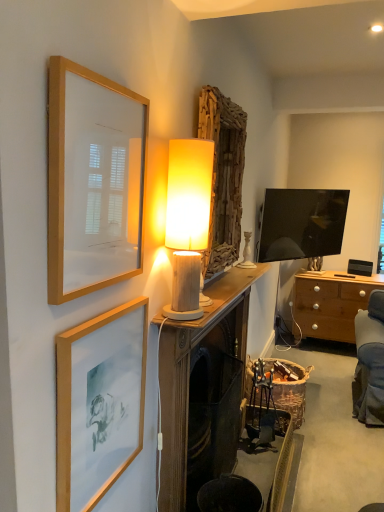
Measure the distance between metallic silver swivel chair at lower right and camera.

The distance of metallic silver swivel chair at lower right from camera is 8.23 feet.

You are a GUI agent. You are given a task and a screenshot of the screen. Output one action in this format:
    pyautogui.click(x=<x>, y=<y>)
    Task: Click on the wooden chest of drawers at right
    The image size is (384, 512).
    Given the screenshot: What is the action you would take?
    pyautogui.click(x=331, y=303)

The height and width of the screenshot is (512, 384). Describe the element at coordinates (331, 303) in the screenshot. I see `wooden chest of drawers at right` at that location.

Where is `wooden framed print at upper left, the 2th picture frame in the bottom-to-top sequence`? The height and width of the screenshot is (512, 384). wooden framed print at upper left, the 2th picture frame in the bottom-to-top sequence is located at coordinates (93, 181).

Locate an element on the screen. The width and height of the screenshot is (384, 512). metallic silver swivel chair at lower right is located at coordinates (264, 408).

From the image's perspective, does wooden mantlepiece at center appear lower than matte gold picture frame at lower left, which appears as the 2th picture frame when viewed from the top?

Yes, from the image's perspective, wooden mantlepiece at center is beneath matte gold picture frame at lower left, which appears as the 2th picture frame when viewed from the top.

Which is more to the left, wooden mantlepiece at center or matte gold picture frame at lower left, which is the first picture frame in bottom-to-top order?

From the viewer's perspective, matte gold picture frame at lower left, which is the first picture frame in bottom-to-top order, appears more on the left side.

Is point (170, 351) positioned in front of point (82, 387)?

That is False.

Consider the image. Who is smaller, wooden mantlepiece at center or matte gold picture frame at lower left, which is the first picture frame in bottom-to-top order?

Smaller between the two is matte gold picture frame at lower left, which is the first picture frame in bottom-to-top order.

From a real-world perspective, is wooden chest of drawers at right physically below wooden cylindrical lamp at center?

Correct, in the physical world, wooden chest of drawers at right is lower than wooden cylindrical lamp at center.

From the image's perspective, does wooden chest of drawers at right appear lower than wooden cylindrical lamp at center?

Correct, wooden chest of drawers at right appears lower than wooden cylindrical lamp at center in the image.

Considering the relative sizes of wooden chest of drawers at right and wooden cylindrical lamp at center in the image provided, is wooden chest of drawers at right taller than wooden cylindrical lamp at center?

Yes.

Is wooden chest of drawers at right a part of wooden mantlepiece at center?

Definitely not — wooden chest of drawers at right is not inside wooden mantlepiece at center.

Is wooden mantlepiece at center far away from wooden chest of drawers at right?

wooden mantlepiece at center is positioned a significant distance from wooden chest of drawers at right.

Looking at their sizes, would you say wooden mantlepiece at center is wider or thinner than wooden chest of drawers at right?

wooden mantlepiece at center is thinner than wooden chest of drawers at right.

In terms of height, does wooden mantlepiece at center look taller or shorter compared to wooden chest of drawers at right?

In the image, wooden mantlepiece at center appears to be taller than wooden chest of drawers at right.

Where is `swivel chair on the left of wooden chest of drawers at right`? swivel chair on the left of wooden chest of drawers at right is located at coordinates (264, 408).

From the image's perspective, is metallic silver swivel chair at lower right on wooden chest of drawers at right?

No, from the image's perspective, metallic silver swivel chair at lower right is not over wooden chest of drawers at right.

Is metallic silver swivel chair at lower right positioned with its back to wooden chest of drawers at right?

metallic silver swivel chair at lower right does not have its back to wooden chest of drawers at right.

Considering the relative sizes of matte gold picture frame at lower left, which is the first picture frame in bottom-to-top order, and wooden cylindrical lamp at center in the image provided, is matte gold picture frame at lower left, which is the first picture frame in bottom-to-top order, shorter than wooden cylindrical lamp at center?

Correct, matte gold picture frame at lower left, which is the first picture frame in bottom-to-top order, is not as tall as wooden cylindrical lamp at center.

Based on the photo, is matte gold picture frame at lower left, which is the first picture frame in bottom-to-top order, facing away from wooden cylindrical lamp at center?

That's not correct — matte gold picture frame at lower left, which is the first picture frame in bottom-to-top order, is not looking away from wooden cylindrical lamp at center.

Which is more to the right, matte gold picture frame at lower left, which is the first picture frame in bottom-to-top order, or wooden cylindrical lamp at center?

wooden cylindrical lamp at center.

Is matte gold picture frame at lower left, which is the first picture frame in bottom-to-top order, next to wooden cylindrical lamp at center?

No.

Does wooden framed print at upper left, the 2th picture frame in the bottom-to-top sequence, turn towards wooden chest of drawers at right?

No, wooden framed print at upper left, the 2th picture frame in the bottom-to-top sequence, is not oriented towards wooden chest of drawers at right.

Is point (122, 186) closer or farther from the camera than point (320, 288)?

Point (122, 186) is closer to the camera than point (320, 288).

In the image, is wooden framed print at upper left, arranged as the 1th picture frame when viewed from the top, on the left side or the right side of wooden chest of drawers at right?

wooden framed print at upper left, arranged as the 1th picture frame when viewed from the top, is positioned on wooden chest of drawers at right's left side.

What are the coordinates of `swivel chair behind the matte gold picture frame at lower left, which is the first picture frame in bottom-to-top order` in the screenshot? It's located at (264, 408).

What's the angular difference between metallic silver swivel chair at lower right and matte gold picture frame at lower left, which is the first picture frame in bottom-to-top order,'s facing directions?

The angle between the facing direction of metallic silver swivel chair at lower right and the facing direction of matte gold picture frame at lower left, which is the first picture frame in bottom-to-top order, is 1.1 degrees.

Considering the sizes of objects metallic silver swivel chair at lower right and matte gold picture frame at lower left, which is the first picture frame in bottom-to-top order, in the image provided, who is bigger, metallic silver swivel chair at lower right or matte gold picture frame at lower left, which is the first picture frame in bottom-to-top order,?

metallic silver swivel chair at lower right.

Identify the location of cabinetry below the matte gold picture frame at lower left, which is the first picture frame in bottom-to-top order (from the image's perspective). (203, 390).

Find the location of a particular element. lamp that is above the wooden chest of drawers at right (from the image's perspective) is located at coordinates (188, 221).

When comparing their distances from wooden framed print at upper left, the 2th picture frame in the bottom-to-top sequence, does wooden chest of drawers at right or metallic silver swivel chair at lower right seem further?

Among the two, wooden chest of drawers at right is located further to wooden framed print at upper left, the 2th picture frame in the bottom-to-top sequence.

Based on their spatial positions, is metallic silver swivel chair at lower right or matte gold picture frame at lower left, which is the first picture frame in bottom-to-top order, further from wooden framed print at upper left, the 2th picture frame in the bottom-to-top sequence?

Among the two, metallic silver swivel chair at lower right is located further to wooden framed print at upper left, the 2th picture frame in the bottom-to-top sequence.

Which object lies further to the anchor point wooden framed print at upper left, arranged as the 1th picture frame when viewed from the top, wooden chest of drawers at right or wooden mantlepiece at center?

wooden chest of drawers at right.

When comparing their distances from wooden chest of drawers at right, does wooden cylindrical lamp at center or metallic silver swivel chair at lower right seem further?

wooden cylindrical lamp at center lies further to wooden chest of drawers at right than the other object.

Looking at the image, which one is located further to wooden framed print at upper left, arranged as the 1th picture frame when viewed from the top, wooden chest of drawers at right or matte gold picture frame at lower left, which appears as the 2th picture frame when viewed from the top?

wooden chest of drawers at right lies further to wooden framed print at upper left, arranged as the 1th picture frame when viewed from the top, than the other object.

Based on their spatial positions, is wooden cylindrical lamp at center or wooden chest of drawers at right further from metallic silver swivel chair at lower right?

wooden chest of drawers at right.

When comparing their distances from matte gold picture frame at lower left, which appears as the 2th picture frame when viewed from the top, does wooden chest of drawers at right or wooden cylindrical lamp at center seem further?

wooden chest of drawers at right is further to matte gold picture frame at lower left, which appears as the 2th picture frame when viewed from the top.

When comparing their distances from wooden framed print at upper left, the 2th picture frame in the bottom-to-top sequence, does wooden mantlepiece at center or wooden cylindrical lamp at center seem closer?

wooden cylindrical lamp at center is positioned closer to the anchor wooden framed print at upper left, the 2th picture frame in the bottom-to-top sequence.

Where is `lamp between wooden framed print at upper left, arranged as the 1th picture frame when viewed from the top, and matte gold picture frame at lower left, which appears as the 2th picture frame when viewed from the top, vertically`? The image size is (384, 512). lamp between wooden framed print at upper left, arranged as the 1th picture frame when viewed from the top, and matte gold picture frame at lower left, which appears as the 2th picture frame when viewed from the top, vertically is located at coordinates (188, 221).

What are the coordinates of `picture frame between wooden framed print at upper left, arranged as the 1th picture frame when viewed from the top, and wooden mantlepiece at center, in the vertical direction` in the screenshot? It's located at (99, 403).

You are a GUI agent. You are given a task and a screenshot of the screen. Output one action in this format:
    pyautogui.click(x=<x>, y=<y>)
    Task: Click on the cabinetry between wooden cylindrical lamp at center and metallic silver swivel chair at lower right in the front-back direction
    The image size is (384, 512).
    Given the screenshot: What is the action you would take?
    pyautogui.click(x=203, y=390)

I want to click on cabinetry positioned between wooden framed print at upper left, the 2th picture frame in the bottom-to-top sequence, and metallic silver swivel chair at lower right from near to far, so click(203, 390).